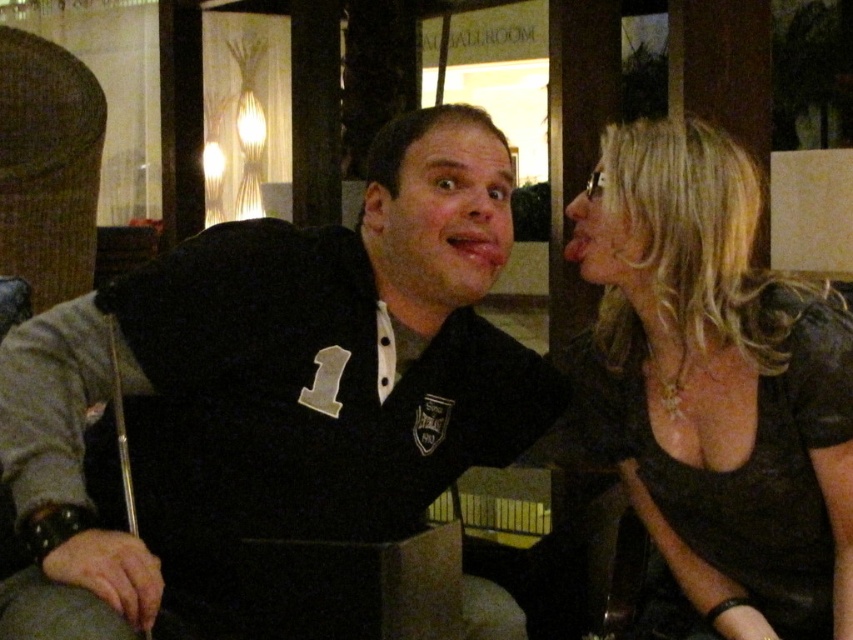
Question: Can you confirm if matte black face at center is bigger than smooth skin face at upper right?

Choices:
 (A) yes
 (B) no

Answer: (A)

Question: Is black jersey at center smaller than smooth skin face at upper right?

Choices:
 (A) yes
 (B) no

Answer: (B)

Question: Based on their relative distances, which object is nearer to the smooth skin face at upper right?

Choices:
 (A) shiny black dress at right
 (B) black jersey at center
 (C) matte black face at center

Answer: (C)

Question: Estimate the real-world distances between objects in this image. Which object is closer to the black jersey at center?

Choices:
 (A) matte black face at center
 (B) shiny black dress at right

Answer: (A)

Question: Considering the real-world distances, which object is closest to the black jersey at center?

Choices:
 (A) matte black face at center
 (B) shiny black dress at right
 (C) smooth skin face at upper right

Answer: (A)

Question: Considering the relative positions of shiny black dress at right and smooth skin face at upper right in the image provided, where is shiny black dress at right located with respect to smooth skin face at upper right?

Choices:
 (A) right
 (B) left

Answer: (A)